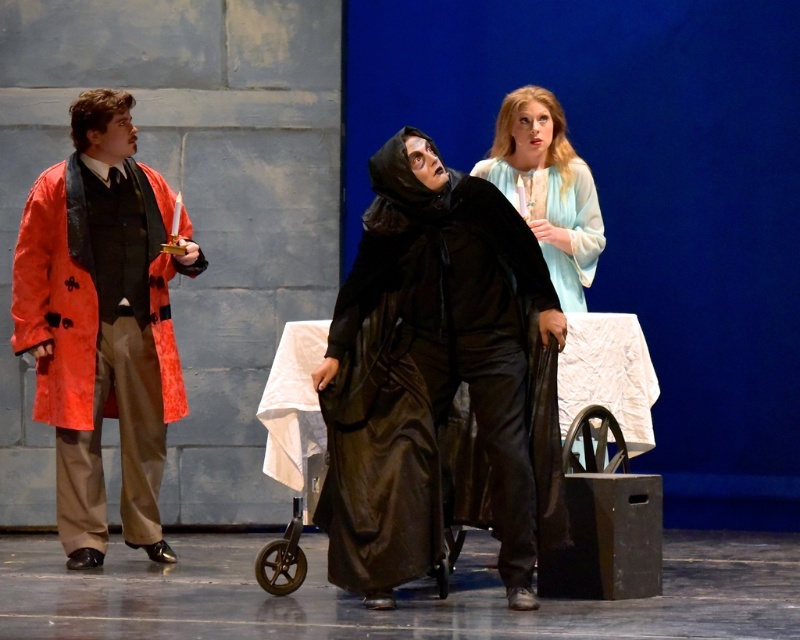
Question: Which of the following is the closest to the observer?

Choices:
 (A) light blue silk dress at center
 (B) velvet black robe at center

Answer: (B)

Question: Is shiny red coat at left wider than light blue silk dress at center?

Choices:
 (A) no
 (B) yes

Answer: (B)

Question: Is the position of velvet black robe at center less distant than that of shiny red coat at left?

Choices:
 (A) yes
 (B) no

Answer: (A)

Question: Which object appears farthest from the camera in this image?

Choices:
 (A) shiny red coat at left
 (B) light blue silk dress at center
 (C) velvet black robe at center

Answer: (B)

Question: Estimate the real-world distances between objects in this image. Which object is farther from the velvet black robe at center?

Choices:
 (A) light blue silk dress at center
 (B) shiny red coat at left

Answer: (B)

Question: Observing the image, what is the correct spatial positioning of velvet black robe at center in reference to shiny red coat at left?

Choices:
 (A) left
 (B) right

Answer: (B)